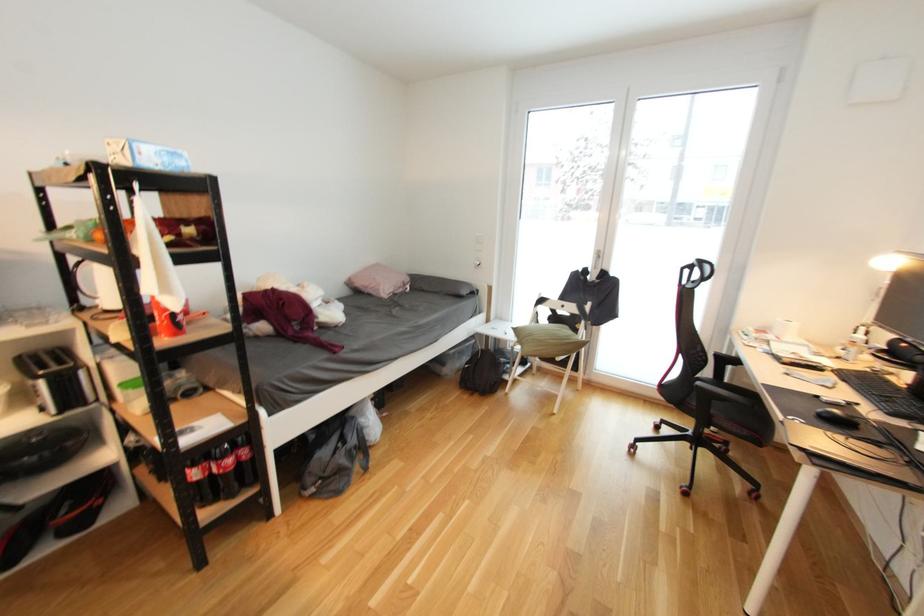
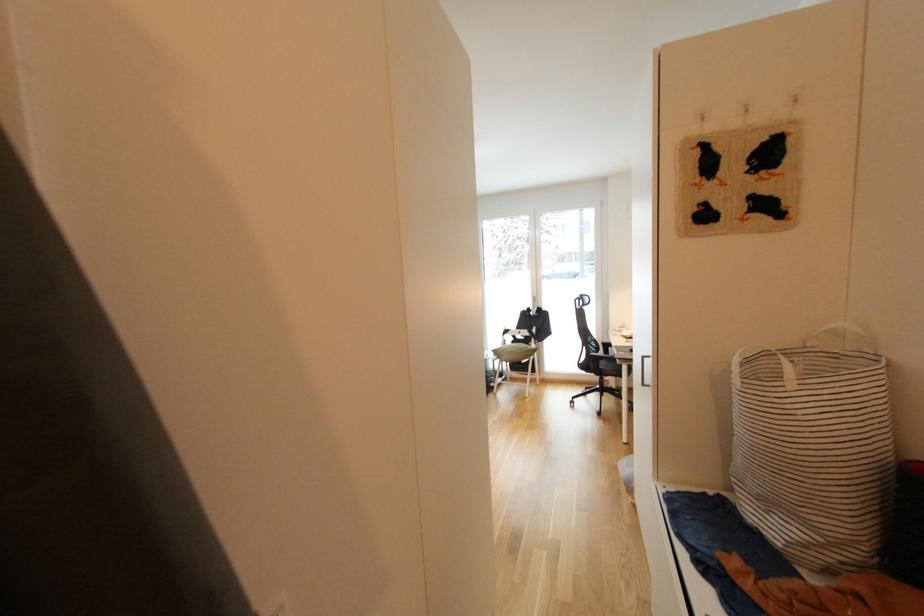
What movement of the cameraman would produce the second image?

The cameraman moved toward left, backward.